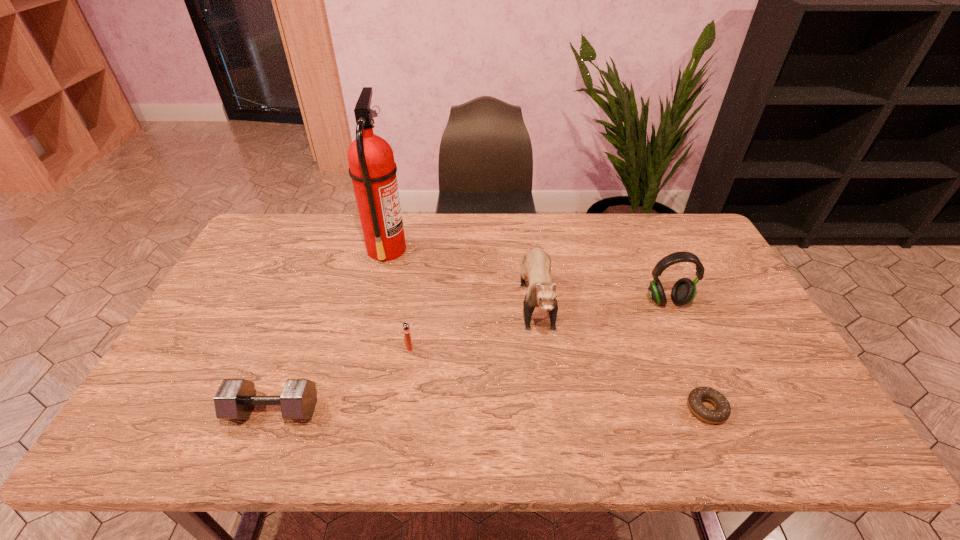
Identify the location of object that is the third closest to the fourth object from right to left. The width and height of the screenshot is (960, 540). (372, 168).

This screenshot has width=960, height=540. Find the location of `the fourth closest object to the dumbbell`. the fourth closest object to the dumbbell is located at coordinates (722, 412).

At what (x,y) coordinates should I click in order to perform the action: click on vacant region that satisfies the following two spatial constraints: 1. on the side of the igniter near the handle; 2. on the right side of the tallest object. Please return your answer as a coordinate pair (x, y). Looking at the image, I should click on (362, 347).

You are a GUI agent. You are given a task and a screenshot of the screen. Output one action in this format:
    pyautogui.click(x=<x>, y=<y>)
    Task: Click on the free space in the image that satisfies the following two spatial constraints: 1. on the side of the third object from left to right near the handle; 2. on the right side of the second object from left to right
    The width and height of the screenshot is (960, 540).
    Given the screenshot: What is the action you would take?
    pyautogui.click(x=362, y=347)

Find the location of a particular element. This screenshot has width=960, height=540. free space that satisfies the following two spatial constraints: 1. on the side of the fourth object from right to left near the handle; 2. on the left side of the second object from left to right is located at coordinates pos(362,347).